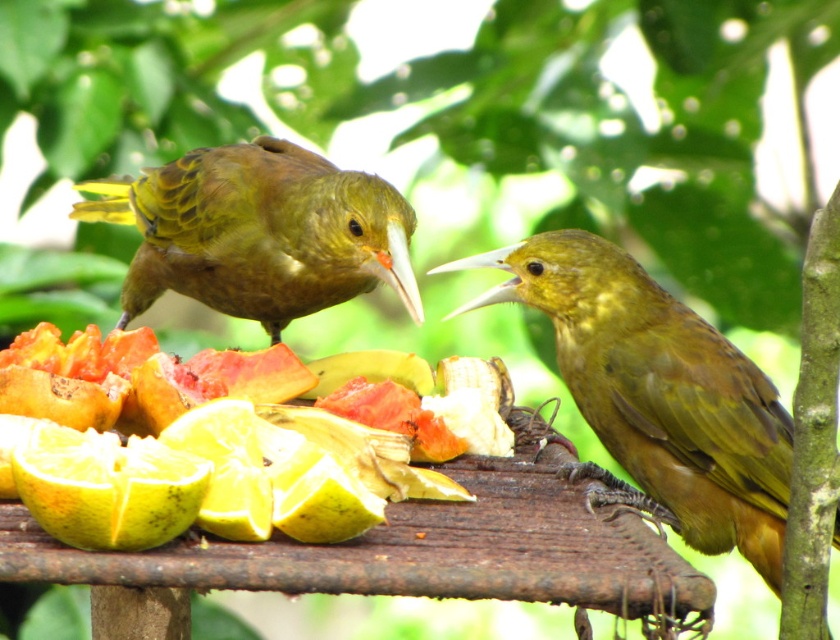
Question: In this image, where is green matte bird at right located relative to ripe yellow orange at lower left?

Choices:
 (A) above
 (B) below

Answer: (A)

Question: Estimate the real-world distances between objects in this image. Which object is farther from the green matte bird at center?

Choices:
 (A) juicy orange slices at lower left
 (B) ripe yellow orange at lower left

Answer: (B)

Question: Is juicy orange slices at lower left closer to the viewer compared to ripe yellow orange at lower left?

Choices:
 (A) no
 (B) yes

Answer: (A)

Question: Which point appears closest to the camera in this image?

Choices:
 (A) (347, 177)
 (B) (156, 468)

Answer: (B)

Question: Which of the following is the farthest from the observer?

Choices:
 (A) (344, 212)
 (B) (150, 474)
 (C) (232, 499)
 (D) (759, 394)

Answer: (A)

Question: Does juicy orange slices at lower left have a greater width compared to green matte bird at center?

Choices:
 (A) yes
 (B) no

Answer: (A)